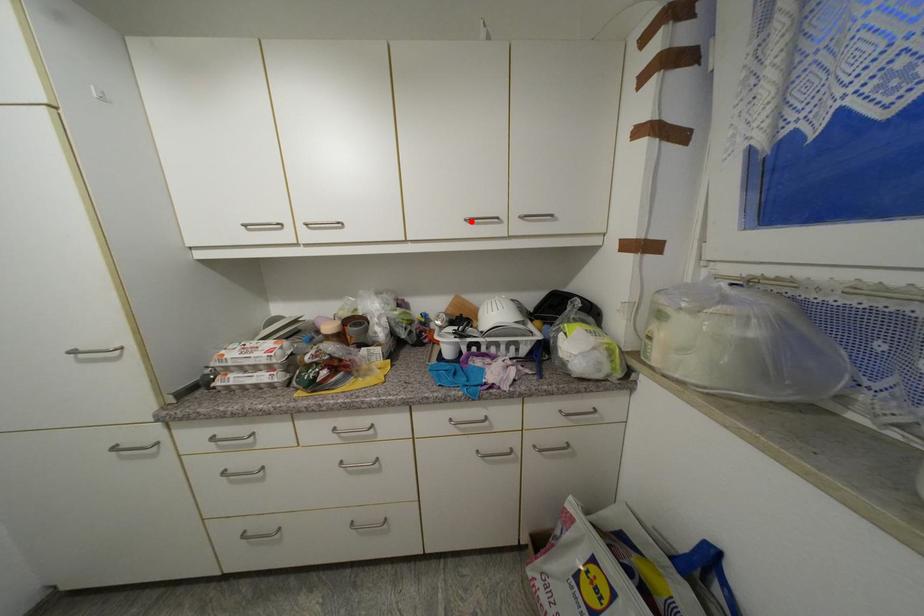
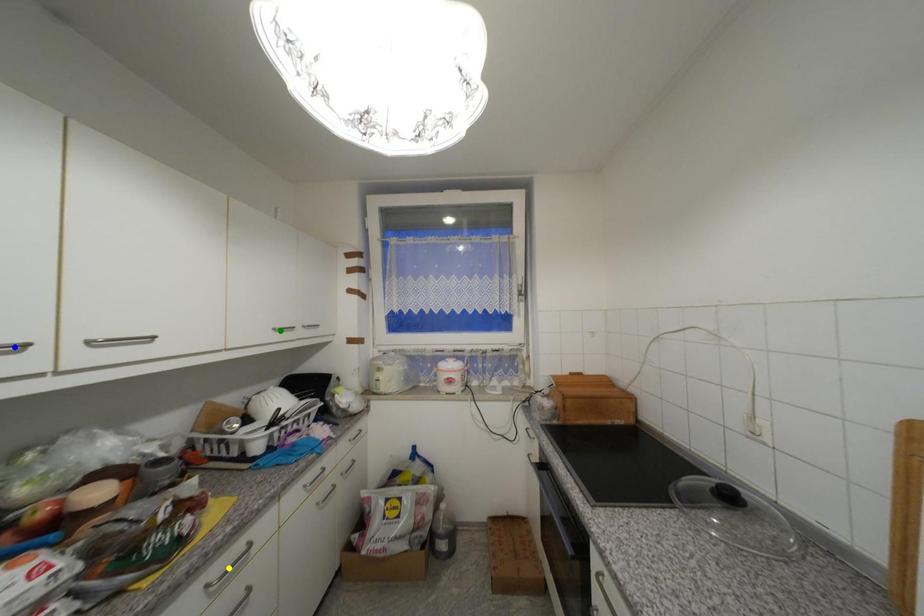
Question: I am providing you with two images of the same scene from different viewpoints. A red point is marked on the first image. You are given multiple points on the second image. Which point in image 2 represents the same 3d spot as the red point in image 1?

Choices:
 (A) green point
 (B) yellow point
 (C) blue point

Answer: (A)